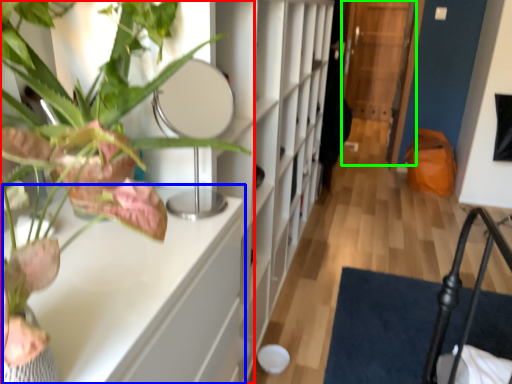
Question: Which is farther away from houseplant (highlighted by a red box)? table (highlighted by a blue box) or glass door (highlighted by a green box)?

Choices:
 (A) table
 (B) glass door

Answer: (B)